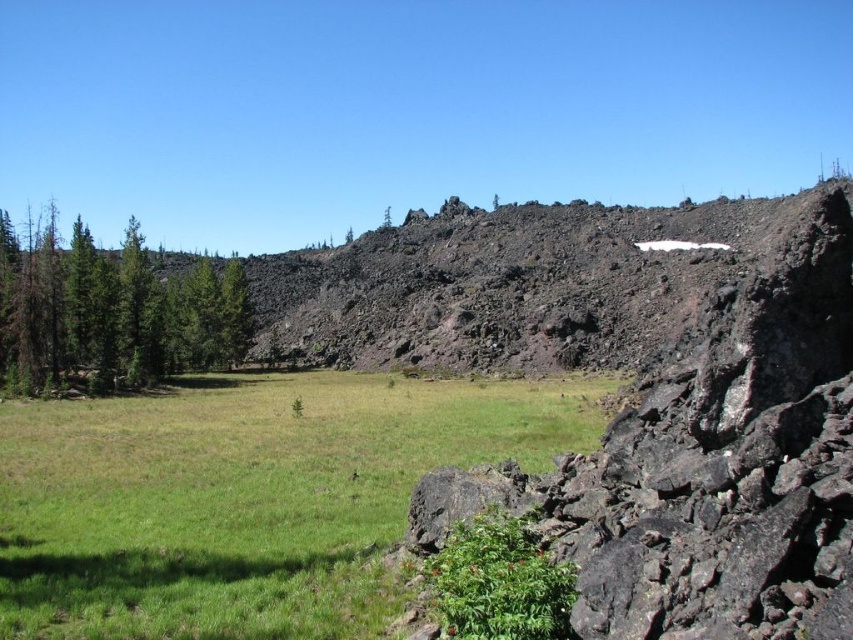
You are standing at the edge of the rocky outcrop and want to reach the green grassy field at center. Which direction should you move to get there?

The green grassy field at center is located at point (245,499), so you should move towards the coordinates to reach it.

You are a hiker standing on the green grassy field at center and want to reach the green matte trees at left. Which direction should you walk to get there?

The green grassy field at center is positioned under green matte trees at left, so you should walk towards the left direction to reach the green matte trees at left.

You are standing in the meadow and want to know which is taller between the green grassy field at center and the green matte trees at left. Can you determine this based on the scene?

The green grassy field at center has a lesser height compared to green matte trees at left, so the green matte trees at left are taller.